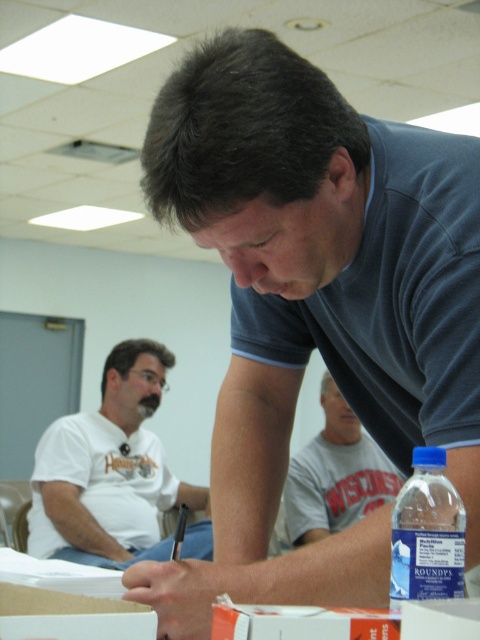
Between point (427, 404) and point (347, 452), which one is positioned behind?

The point (347, 452) is behind.

Where is `dark blue shirt at center`? This screenshot has width=480, height=640. dark blue shirt at center is located at coordinates (314, 307).

The image size is (480, 640). What do you see at coordinates (314, 307) in the screenshot?
I see `dark blue shirt at center` at bounding box center [314, 307].

This screenshot has width=480, height=640. Identify the location of dark blue shirt at center. (314, 307).

Between white matte t-shirt at lower left and white cotton t-shirt at center, which one has more height?

With more height is white matte t-shirt at lower left.

Between point (91, 470) and point (327, 497), which one is positioned behind?

The point (91, 470) is more distant.

Find the location of `white matte t-shirt at lower left`. white matte t-shirt at lower left is located at coordinates (108, 470).

Find the location of a particular element. The image size is (480, 640). white matte t-shirt at lower left is located at coordinates (108, 470).

Based on the photo, can you confirm if white matte t-shirt at lower left is positioned to the right of blue plastic water bottle at lower right?

In fact, white matte t-shirt at lower left is to the left of blue plastic water bottle at lower right.

Can you confirm if white matte t-shirt at lower left is wider than blue plastic water bottle at lower right?

Yes, white matte t-shirt at lower left is wider than blue plastic water bottle at lower right.

Is point (108, 376) positioned behind point (421, 492)?

Yes.

Where is `white matte t-shirt at lower left`? The width and height of the screenshot is (480, 640). white matte t-shirt at lower left is located at coordinates (108, 470).